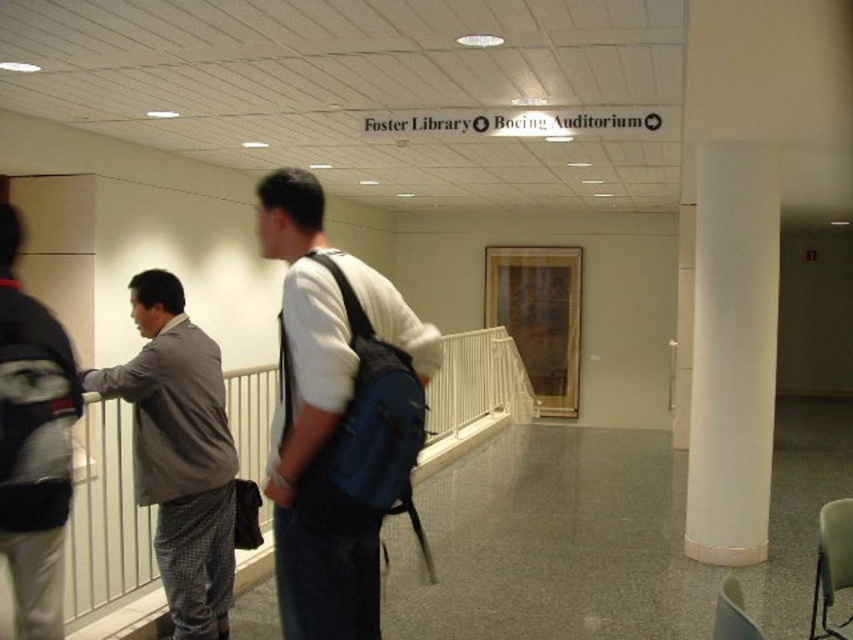
Is white glossy column at right wider than white plastic rail at center?

Indeed, white glossy column at right has a greater width compared to white plastic rail at center.

Which is in front, point (698, 560) or point (96, 630)?

Positioned in front is point (96, 630).

Where is `white glossy column at right`? white glossy column at right is located at coordinates (x=732, y=352).

This screenshot has width=853, height=640. What do you see at coordinates (338, 417) in the screenshot?
I see `matte blue backpack at center` at bounding box center [338, 417].

Identify the location of matte blue backpack at center. (338, 417).

This screenshot has height=640, width=853. What are the coordinates of `matte blue backpack at center` in the screenshot? It's located at (338, 417).

Does white glossy column at right appear under white plastic chair at lower right?

No, white glossy column at right is not below white plastic chair at lower right.

I want to click on white glossy column at right, so click(732, 352).